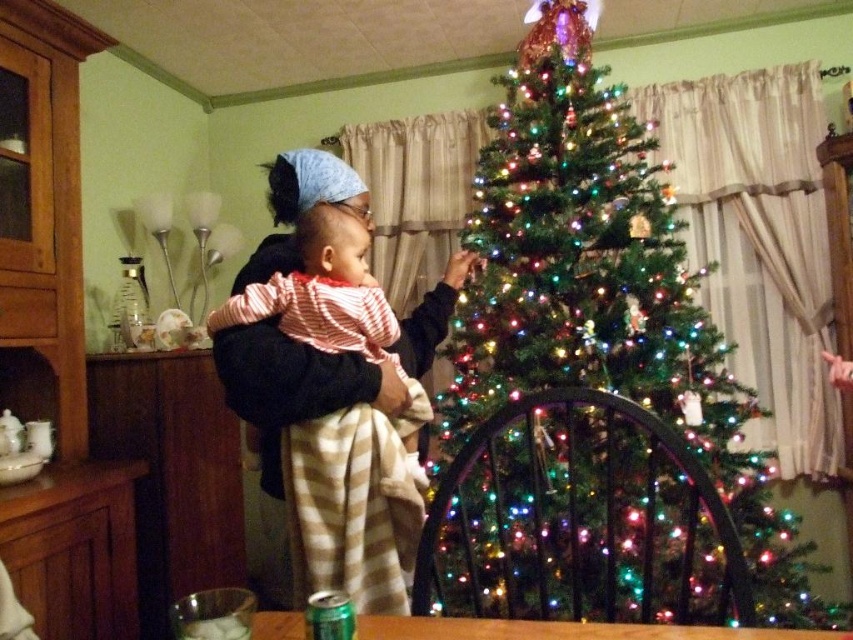
Does green matte christmas tree at center have a lesser height compared to striped fabric blanket at center?

No, green matte christmas tree at center is not shorter than striped fabric blanket at center.

Is point (589, 604) closer to camera compared to point (300, 417)?

No.

Identify the location of green matte christmas tree at center. The image size is (853, 640). (604, 292).